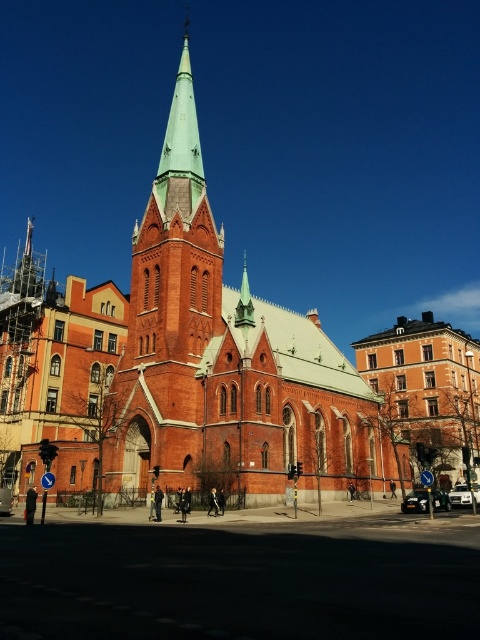
You are standing on the street in front of the red brick church at center. You want to take a photo of the church with your smartphone. The maximum distance your smartphone can autofocus is 50 meters. Will you be able to take a clear photo of the church?

The red brick church at center and viewer are 48.08 meters apart from each other. Since 48.08 meters is within the 50 meters autofocus range of the smartphone, you can take a clear photo of the church.

You are a pedestrian standing at the crosswalk near the red brick church at center and the metallic silver car at lower right. Which object is closer to you?

The red brick church at center is closer to you because it is positioned in front of the metallic silver car at lower right, meaning the car is further away in the background.